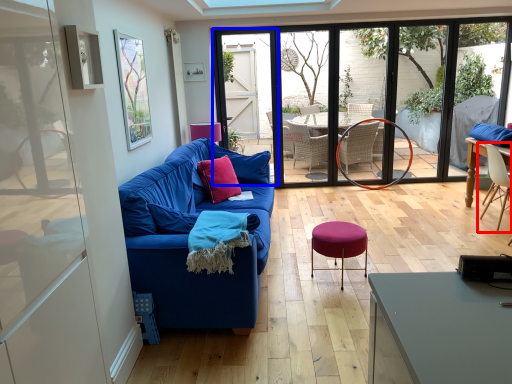
Question: Which point is further to the camera, chair (highlighted by a red box) or screen door (highlighted by a blue box)?

Choices:
 (A) chair
 (B) screen door

Answer: (B)